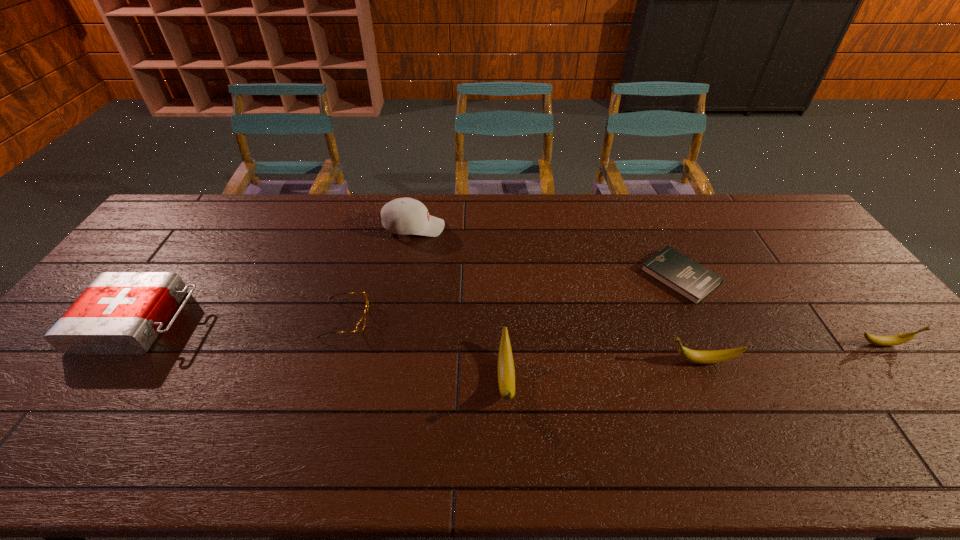
The width and height of the screenshot is (960, 540). What are the coordinates of `vacant position at the far edge of the desktop` in the screenshot? It's located at (349, 202).

Locate an element on the screen. vacant space at the near edge is located at coordinates (342, 418).

Where is `vacant area at the left edge`? The width and height of the screenshot is (960, 540). vacant area at the left edge is located at coordinates (148, 267).

The width and height of the screenshot is (960, 540). In order to click on vacant region at the right edge of the desktop in this screenshot , I will do pyautogui.click(x=863, y=352).

Identify the location of vacant space at the far left corner of the desktop. The height and width of the screenshot is (540, 960). point(204,198).

The width and height of the screenshot is (960, 540). In the image, there is a desktop. What are the coordinates of `free region at the near left corner` in the screenshot? It's located at click(x=64, y=388).

I want to click on free spot between the shortest banana and the second banana from right to left, so point(792,353).

You are a GUI agent. You are given a task and a screenshot of the screen. Output one action in this format:
    pyautogui.click(x=<x>, y=<y>)
    Task: Click on the free point between the rightmost object and the spectacles
    
    Given the screenshot: What is the action you would take?
    pyautogui.click(x=614, y=332)

Find the location of `vacant region between the shortest object and the second shortest banana`. vacant region between the shortest object and the second shortest banana is located at coordinates (691, 319).

The height and width of the screenshot is (540, 960). I want to click on vacant space in between the rightmost object and the first-aid kit, so click(x=512, y=333).